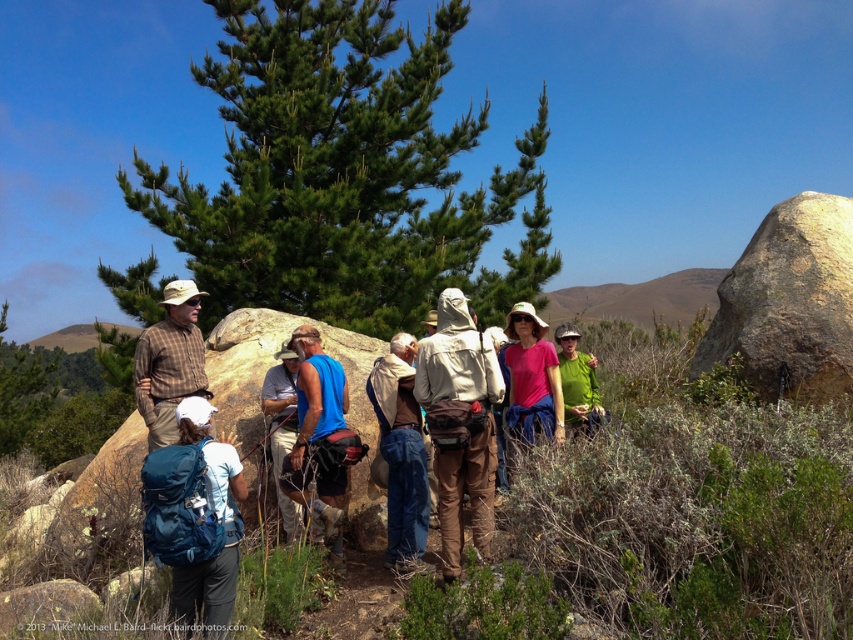
Is blue fabric backpack at lower left above plaid fabric shirt at center?

No.

The image size is (853, 640). What do you see at coordinates (210, 520) in the screenshot?
I see `blue fabric backpack at lower left` at bounding box center [210, 520].

This screenshot has width=853, height=640. Find the location of `blue fabric backpack at lower left`. blue fabric backpack at lower left is located at coordinates (210, 520).

Between brown leather backpack at center and green matte shirt at center, which one has less height?

With less height is green matte shirt at center.

Can you confirm if brown leather backpack at center is shorter than green matte shirt at center?

In fact, brown leather backpack at center may be taller than green matte shirt at center.

Is point (271, 403) more distant than point (576, 400)?

No, (271, 403) is in front of (576, 400).

Image resolution: width=853 pixels, height=640 pixels. In order to click on brown leather backpack at center in this screenshot , I will do `click(282, 428)`.

The height and width of the screenshot is (640, 853). I want to click on blue fabric backpack at lower left, so click(x=210, y=520).

From the picture: Does blue fabric backpack at lower left have a greater width compared to brown leather backpack at center?

Indeed, blue fabric backpack at lower left has a greater width compared to brown leather backpack at center.

The width and height of the screenshot is (853, 640). In order to click on blue fabric backpack at lower left in this screenshot , I will do `click(210, 520)`.